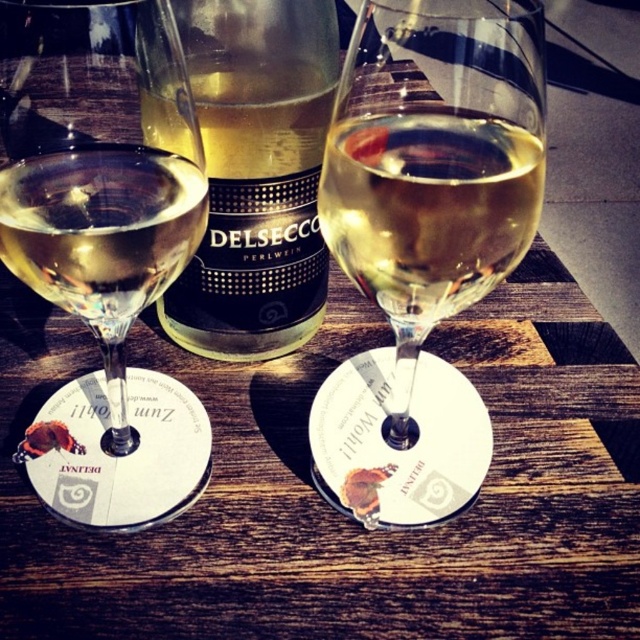
Question: Does clear glass wine glass at left appear under translucent glass wine at center?

Choices:
 (A) no
 (B) yes

Answer: (B)

Question: From the image, what is the correct spatial relationship of translucent glass wine at center in relation to clear glass wine at left?

Choices:
 (A) left
 (B) right

Answer: (B)

Question: Which point is closer to the camera taking this photo?

Choices:
 (A) (16, 225)
 (B) (381, 241)
 (C) (177, 145)
 (D) (168, 220)

Answer: (A)

Question: Does translucent glass wine glass at center appear over translucent glass bottle at center?

Choices:
 (A) no
 (B) yes

Answer: (A)

Question: Which point is farther from the camera taking this photo?

Choices:
 (A) (36, 276)
 (B) (257, 17)
 (C) (96, 81)

Answer: (B)

Question: Which object is positioned farthest from the translucent glass wine glass at center?

Choices:
 (A) clear glass wine at left
 (B) translucent glass bottle at center
 (C) clear glass wine glass at left
 (D) translucent glass wine at center

Answer: (A)